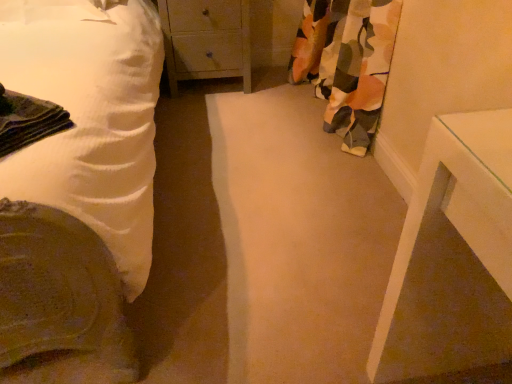
The image size is (512, 384). What are the coordinates of `floral fabric curtain at right` in the screenshot? It's located at (347, 62).

Locate an element on the screen. Image resolution: width=512 pixels, height=384 pixels. white cotton bed at left is located at coordinates (76, 186).

What is the approximate height of white cotton bed at left?

38.14 inches.

Image resolution: width=512 pixels, height=384 pixels. I want to click on wooden chest of drawers at center, so click(x=206, y=40).

Could you tell me if white cotton bed at left is facing floral fabric curtain at right?

No.

Is white cotton bed at left completely or partially outside of floral fabric curtain at right?

white cotton bed at left lies outside floral fabric curtain at right's area.

Does point (70, 218) come behind point (350, 43)?

No, (70, 218) is closer to viewer.

Considering the relative sizes of white cotton bed at left and wooden chest of drawers at center in the image provided, is white cotton bed at left smaller than wooden chest of drawers at center?

No.

In terms of height, does white cotton bed at left look taller or shorter compared to wooden chest of drawers at center?

white cotton bed at left is taller than wooden chest of drawers at center.

Considering their positions, is white cotton bed at left located in front of or behind wooden chest of drawers at center?

Clearly, white cotton bed at left is in front of wooden chest of drawers at center.

Are white cotton bed at left and wooden chest of drawers at center far apart?

They are positioned close to each other.

Is floral fabric curtain at right completely or partially outside of white cotton bed at left?

Result: floral fabric curtain at right lies outside white cotton bed at left's area.

Between floral fabric curtain at right and white cotton bed at left, which one is positioned behind?

floral fabric curtain at right is more distant.

Does point (373, 94) come closer to viewer compared to point (73, 29)?

No, it is not.

I want to click on bed that is above the floral fabric curtain at right (from a real-world perspective), so click(76, 186).

Based on the photo, is the position of wooden chest of drawers at center more distant than that of white cotton bed at left?

That is True.

Looking at this image, which is further, [158,8] or [101,295]?

Positioned behind is point [158,8].

Is wooden chest of drawers at center not close to white cotton bed at left?

No.

Considering the positions of objects floral fabric curtain at right and wooden chest of drawers at center in the image provided, who is in front, floral fabric curtain at right or wooden chest of drawers at center?

floral fabric curtain at right is in front.

Which is correct: floral fabric curtain at right is inside wooden chest of drawers at center, or outside of it?

floral fabric curtain at right cannot be found inside wooden chest of drawers at center.

Looking at this image, considering the positions of objects floral fabric curtain at right and wooden chest of drawers at center in the image provided, who is more to the right, floral fabric curtain at right or wooden chest of drawers at center?

floral fabric curtain at right.

Can you confirm if floral fabric curtain at right is bigger than wooden chest of drawers at center?

Indeed, floral fabric curtain at right has a larger size compared to wooden chest of drawers at center.

Is wooden chest of drawers at center not near floral fabric curtain at right?

Actually, wooden chest of drawers at center and floral fabric curtain at right are a little close together.

From a real-world perspective, is wooden chest of drawers at center beneath floral fabric curtain at right?

Yes, from a real-world perspective, wooden chest of drawers at center is below floral fabric curtain at right.

Is wooden chest of drawers at center facing away from floral fabric curtain at right?

No, wooden chest of drawers at center's orientation is not away from floral fabric curtain at right.

The height and width of the screenshot is (384, 512). Find the location of `bed below the floral fabric curtain at right (from the image's perspective)`. bed below the floral fabric curtain at right (from the image's perspective) is located at coordinates (76, 186).

In order to click on bed in front of the wooden chest of drawers at center in this screenshot , I will do click(x=76, y=186).

Looking at the image, which one is located closer to floral fabric curtain at right, wooden chest of drawers at center or white cotton bed at left?

wooden chest of drawers at center is closer to floral fabric curtain at right.

Considering their positions, is floral fabric curtain at right positioned closer to wooden chest of drawers at center than white cotton bed at left?

The object closer to wooden chest of drawers at center is floral fabric curtain at right.

Based on their spatial positions, is wooden chest of drawers at center or floral fabric curtain at right further from white cotton bed at left?

Among the two, floral fabric curtain at right is located further to white cotton bed at left.

Based on their spatial positions, is white cotton bed at left or wooden chest of drawers at center further from floral fabric curtain at right?

white cotton bed at left lies further to floral fabric curtain at right than the other object.

Based on the photo, when comparing their distances from white cotton bed at left, does floral fabric curtain at right or wooden chest of drawers at center seem further?

Among the two, floral fabric curtain at right is located further to white cotton bed at left.

Looking at the image, which one is located closer to wooden chest of drawers at center, white cotton bed at left or floral fabric curtain at right?

floral fabric curtain at right.

At what (x,y) coordinates should I click in order to perform the action: click on curtain between white cotton bed at left and wooden chest of drawers at center from front to back. Please return your answer as a coordinate pair (x, y). The height and width of the screenshot is (384, 512). Looking at the image, I should click on (347, 62).